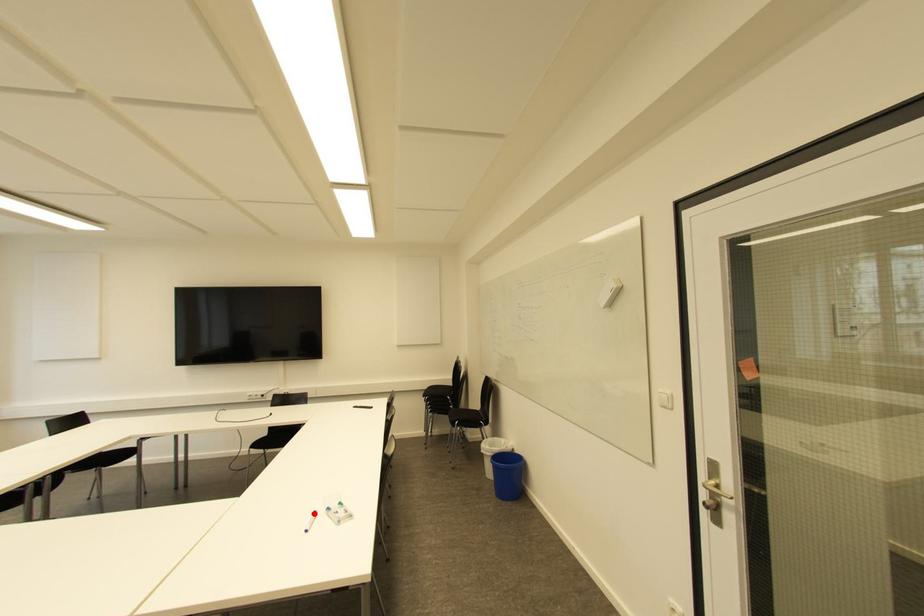
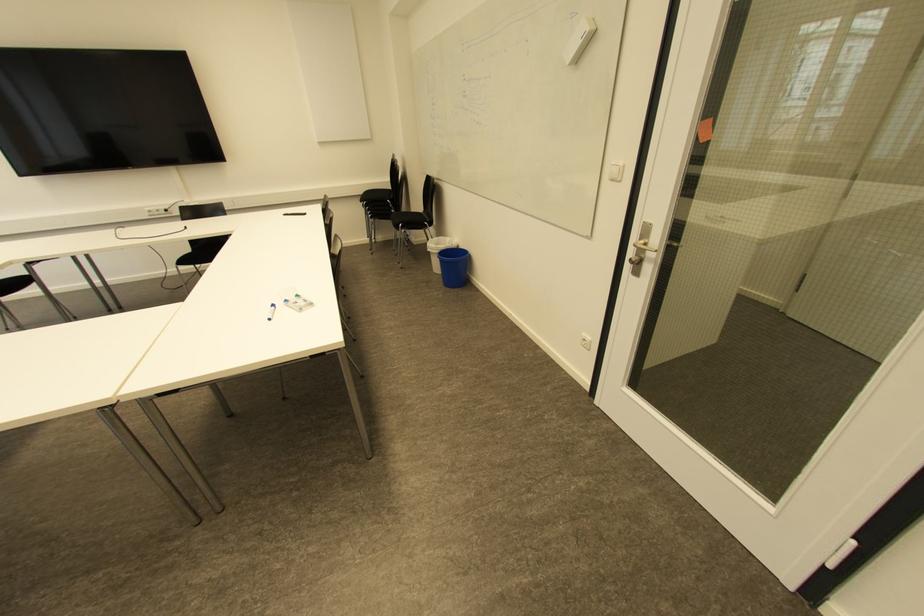
In the second image, find the point that corresponds to the highlighted location in the first image.

(273, 306)